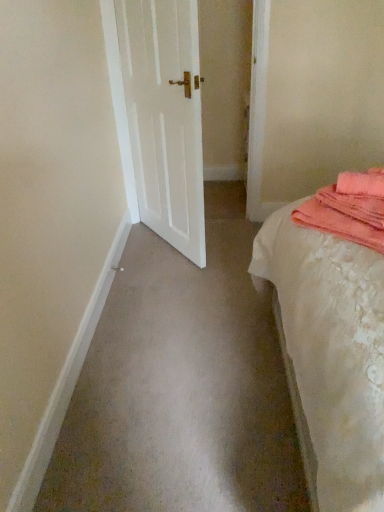
Question: From the image's perspective, is white matte door at center located above white lace bed at right?

Choices:
 (A) no
 (B) yes

Answer: (B)

Question: Can we say white matte door at center lies outside white lace bed at right?

Choices:
 (A) no
 (B) yes

Answer: (B)

Question: Is white matte door at center oriented towards white lace bed at right?

Choices:
 (A) yes
 (B) no

Answer: (B)

Question: Is white matte door at center wider than white lace bed at right?

Choices:
 (A) no
 (B) yes

Answer: (A)

Question: Can you confirm if white matte door at center is thinner than white lace bed at right?

Choices:
 (A) yes
 (B) no

Answer: (A)

Question: Considering the relative sizes of white matte door at center and white lace bed at right in the image provided, is white matte door at center taller than white lace bed at right?

Choices:
 (A) yes
 (B) no

Answer: (A)

Question: Is white lace bed at right further to the viewer compared to white matte door at center?

Choices:
 (A) no
 (B) yes

Answer: (A)

Question: Is white lace bed at right not close to white matte door at center?

Choices:
 (A) yes
 (B) no

Answer: (A)

Question: Considering the relative sizes of white lace bed at right and white matte door at center in the image provided, is white lace bed at right shorter than white matte door at center?

Choices:
 (A) no
 (B) yes

Answer: (B)

Question: Is white lace bed at right wider than white matte door at center?

Choices:
 (A) no
 (B) yes

Answer: (B)

Question: Considering the relative sizes of white lace bed at right and white matte door at center in the image provided, is white lace bed at right bigger than white matte door at center?

Choices:
 (A) yes
 (B) no

Answer: (A)

Question: From the image's perspective, is white lace bed at right under white matte door at center?

Choices:
 (A) yes
 (B) no

Answer: (A)

Question: Considering the relative sizes of pink towel at right and white lace bed at right in the image provided, is pink towel at right taller than white lace bed at right?

Choices:
 (A) yes
 (B) no

Answer: (B)